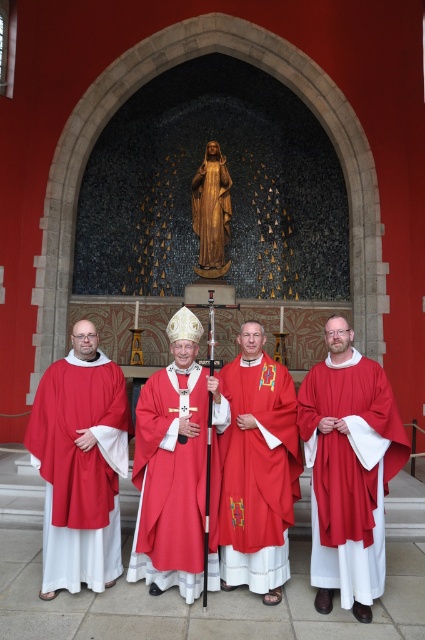
Is matte red fabric at right to the left of matte red robe at center from the viewer's perspective?

No, matte red fabric at right is not to the left of matte red robe at center.

Is matte red fabric at right to the right of matte red robe at center from the viewer's perspective?

Indeed, matte red fabric at right is positioned on the right side of matte red robe at center.

Identify the location of matte red fabric at right. (350, 472).

Locate an element on the screen. This screenshot has width=425, height=640. matte red fabric at right is located at coordinates (350, 472).

Does point (53, 544) come closer to viewer compared to point (263, 538)?

No, it is behind (263, 538).

Is matte red fabric at left taller than matte red robe at center?

No.

What do you see at coordinates (79, 468) in the screenshot?
I see `matte red fabric at left` at bounding box center [79, 468].

What are the coordinates of `matte red fabric at left` in the screenshot? It's located at (79, 468).

How far apart are matte red robe at center and matte red fabric at center?

They are 31.62 inches apart.

Between matte red robe at center and matte red fabric at center, which one appears on the right side from the viewer's perspective?

From the viewer's perspective, matte red robe at center appears more on the right side.

At what (x,y) coordinates should I click in order to perform the action: click on matte red robe at center. Please return your answer as a coordinate pair (x, y). The width and height of the screenshot is (425, 640). Looking at the image, I should click on (257, 474).